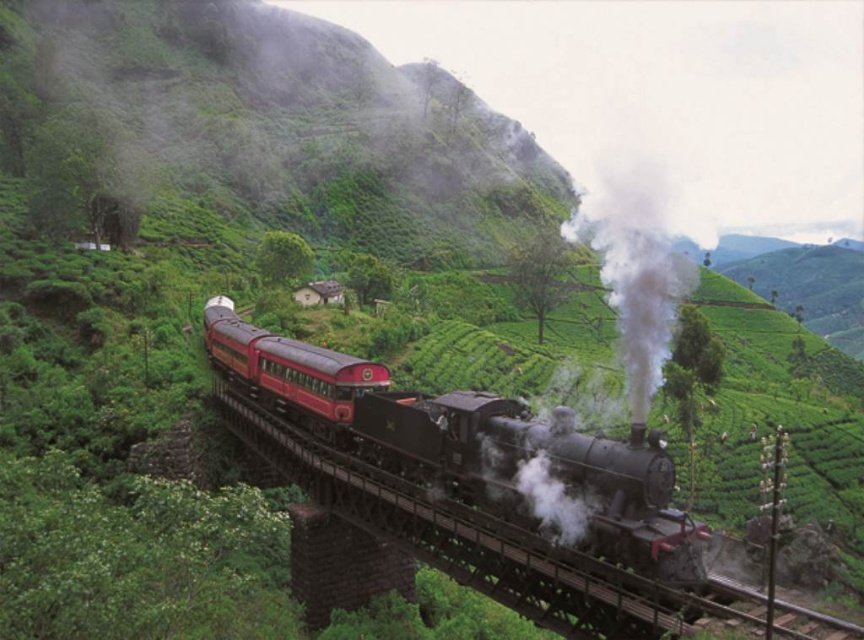
Question: Considering the relative positions of polished black steam engine at center and polished red passenger train at center in the image provided, where is polished black steam engine at center located with respect to polished red passenger train at center?

Choices:
 (A) above
 (B) below

Answer: (B)

Question: Which point is closer to the camera?

Choices:
 (A) white matte smoke at center
 (B) polished black steam engine at center
 (C) polished black steam locomotive at center

Answer: (B)

Question: Which object appears farthest from the camera in this image?

Choices:
 (A) polished black steam locomotive at center
 (B) polished black steam engine at center

Answer: (A)

Question: Is polished black steam engine at center smaller than polished red passenger train at center?

Choices:
 (A) yes
 (B) no

Answer: (A)

Question: Is polished black steam locomotive at center positioned behind polished red passenger train at center?

Choices:
 (A) yes
 (B) no

Answer: (B)

Question: Which object is farther from the camera taking this photo?

Choices:
 (A) polished black steam engine at center
 (B) polished black steam locomotive at center
 (C) white matte smoke at center

Answer: (C)